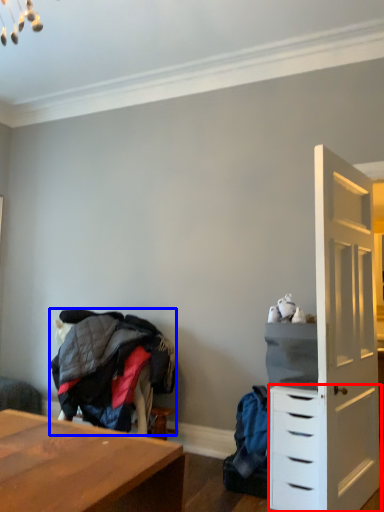
Question: Which point is closer to the camera, chest of drawers (highlighted by a red box) or clothing (highlighted by a blue box)?

Choices:
 (A) chest of drawers
 (B) clothing

Answer: (A)